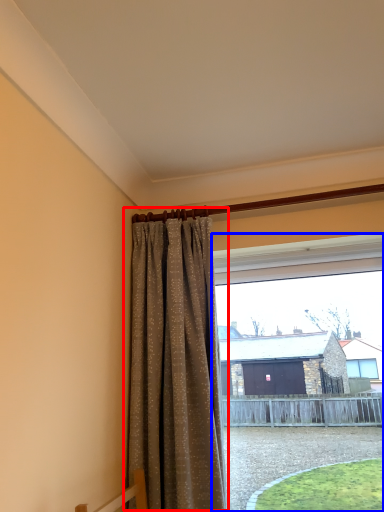
Question: Among these objects, which one is nearest to the camera, curtain (highlighted by a red box) or window (highlighted by a blue box)?

Choices:
 (A) curtain
 (B) window

Answer: (A)